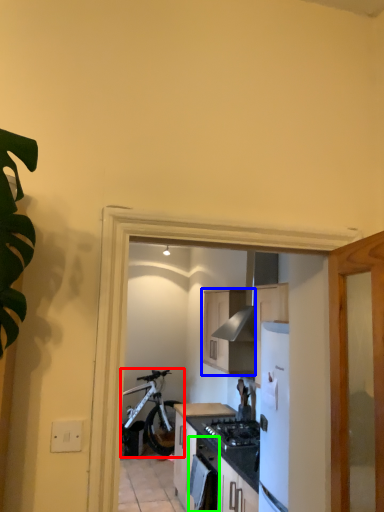
Question: Estimate the real-world distances between objects in this image. Which object is farther from bicycle (highlighted by a red box), cabinetry (highlighted by a blue box) or oven (highlighted by a green box)?

Choices:
 (A) cabinetry
 (B) oven

Answer: (B)